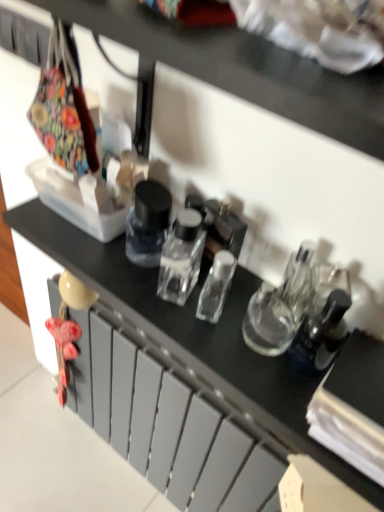
Image resolution: width=384 pixels, height=512 pixels. I want to click on free spot to the left of matte gray drawer at center, so [61, 454].